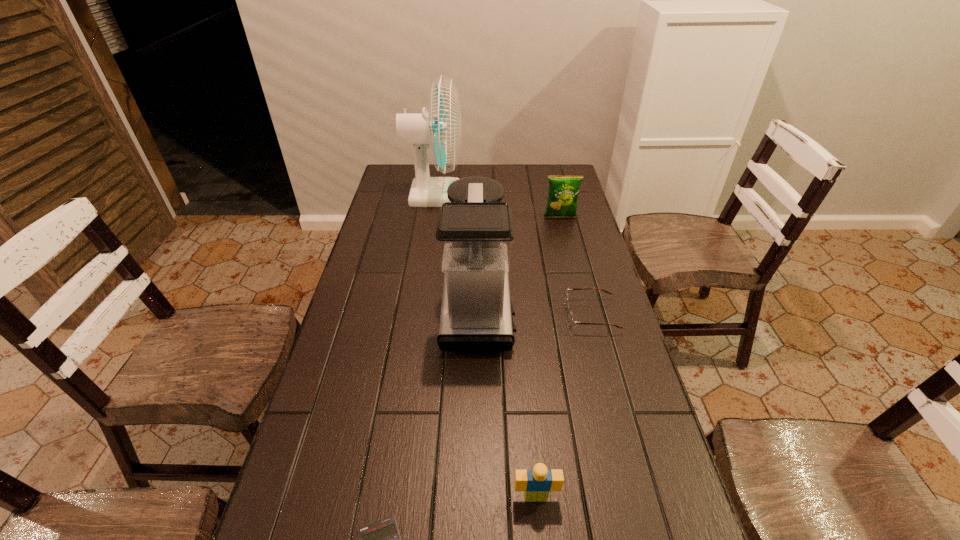
Locate an element on the screen. The height and width of the screenshot is (540, 960). fan is located at coordinates (439, 128).

This screenshot has height=540, width=960. I want to click on coffee maker, so click(x=475, y=234).

Where is `crisp (potato chip)`? crisp (potato chip) is located at coordinates (563, 192).

Find the location of `Lego`. Lego is located at coordinates (536, 483).

Locate an element on the screen. the fourth tallest object is located at coordinates (536, 483).

Where is `spectacles`? spectacles is located at coordinates (571, 321).

Identify the location of free location located in front of the fan to face the airflow. (511, 195).

Identify the location of free region located 0.080m at the front of the coffee maker where the controls are located. This screenshot has height=540, width=960. (540, 308).

You are a GUI agent. You are given a task and a screenshot of the screen. Output one action in this format:
    pyautogui.click(x=<x>, y=<y>)
    Task: Click on the vacant region located on the front-facing side of the third tallest object
    This screenshot has width=960, height=540.
    Given the screenshot: What is the action you would take?
    pyautogui.click(x=566, y=244)

This screenshot has height=540, width=960. Identify the location of vacant region located on the front-facing side of the spectacles. pos(439,315).